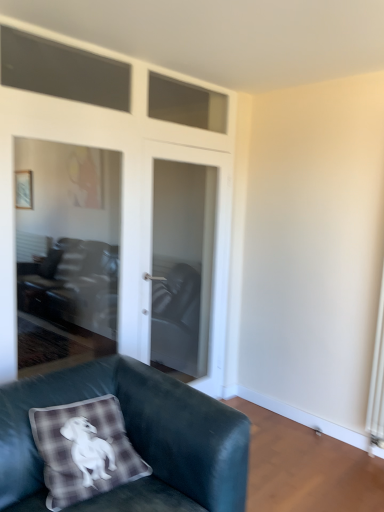
Question: Should I look upward or downward to see velvet dark green couch at lower left?

Choices:
 (A) down
 (B) up

Answer: (A)

Question: Can you confirm if velvet dark green couch at lower left is smaller than white glossy door at center?

Choices:
 (A) no
 (B) yes

Answer: (A)

Question: From a real-world perspective, is velvet dark green couch at lower left located beneath white glossy door at center?

Choices:
 (A) no
 (B) yes

Answer: (B)

Question: Does velvet dark green couch at lower left have a lesser width compared to white glossy door at center?

Choices:
 (A) no
 (B) yes

Answer: (A)

Question: Is velvet dark green couch at lower left positioned behind white glossy door at center?

Choices:
 (A) yes
 (B) no

Answer: (B)

Question: Does velvet dark green couch at lower left turn towards white glossy door at center?

Choices:
 (A) yes
 (B) no

Answer: (B)

Question: Can you confirm if velvet dark green couch at lower left is wider than white glossy door at center?

Choices:
 (A) yes
 (B) no

Answer: (A)

Question: From a real-world perspective, is white glossy door at center located higher than velvet dark green couch at lower left?

Choices:
 (A) yes
 (B) no

Answer: (A)

Question: Is there a large distance between white glossy door at center and velvet dark green couch at lower left?

Choices:
 (A) no
 (B) yes

Answer: (B)

Question: Is white glossy door at center smaller than velvet dark green couch at lower left?

Choices:
 (A) no
 (B) yes

Answer: (B)

Question: Is white glossy door at center beside velvet dark green couch at lower left?

Choices:
 (A) no
 (B) yes

Answer: (A)

Question: Is white glossy door at center at the left side of velvet dark green couch at lower left?

Choices:
 (A) no
 (B) yes

Answer: (A)

Question: Is white glossy door at center bigger than velvet dark green couch at lower left?

Choices:
 (A) yes
 (B) no

Answer: (B)

Question: From their relative heights in the image, would you say white glossy door at center is taller or shorter than velvet dark green couch at lower left?

Choices:
 (A) tall
 (B) short

Answer: (A)